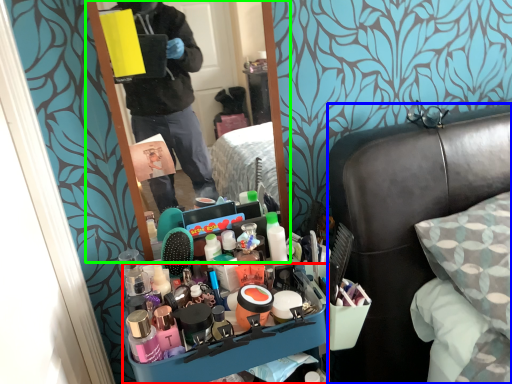
Question: Which object is the closest to the desk (highlighted by a red box)? Choose among these: furniture (highlighted by a blue box) or mirror (highlighted by a green box).

Choices:
 (A) furniture
 (B) mirror

Answer: (A)